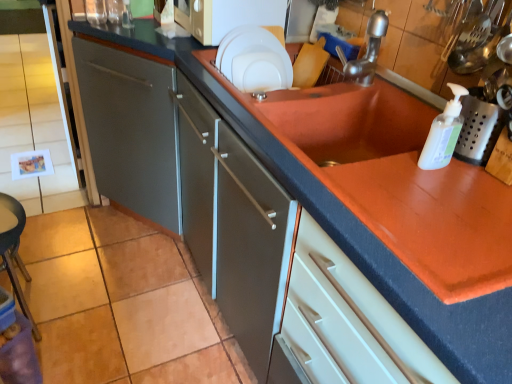
Question: Could you tell me if white matte microwave at upper center is turned towards white glossy plate at upper center?

Choices:
 (A) no
 (B) yes

Answer: (A)

Question: Is white matte microwave at upper center touching white glossy plate at upper center?

Choices:
 (A) no
 (B) yes

Answer: (A)

Question: Does white matte microwave at upper center have a larger size compared to white glossy plate at upper center?

Choices:
 (A) no
 (B) yes

Answer: (B)

Question: Considering the relative sizes of white matte microwave at upper center and white glossy plate at upper center in the image provided, is white matte microwave at upper center smaller than white glossy plate at upper center?

Choices:
 (A) yes
 (B) no

Answer: (B)

Question: From the image's perspective, is white matte microwave at upper center under white glossy plate at upper center?

Choices:
 (A) yes
 (B) no

Answer: (B)

Question: Choose the correct answer: Is white matte microwave at upper center inside silver metallic faucet at upper right or outside it?

Choices:
 (A) outside
 (B) inside

Answer: (A)

Question: Considering the positions of point (208, 41) and point (349, 71), is point (208, 41) closer or farther from the camera than point (349, 71)?

Choices:
 (A) closer
 (B) farther

Answer: (B)

Question: Is white matte microwave at upper center bigger or smaller than silver metallic faucet at upper right?

Choices:
 (A) small
 (B) big

Answer: (B)

Question: Considering the positions of white matte microwave at upper center and silver metallic faucet at upper right in the image, is white matte microwave at upper center taller or shorter than silver metallic faucet at upper right?

Choices:
 (A) tall
 (B) short

Answer: (A)

Question: From their relative heights in the image, would you say white plastic soap dispenser at upper right is taller or shorter than white glossy plate at upper center?

Choices:
 (A) short
 (B) tall

Answer: (A)

Question: From the image's perspective, is white plastic soap dispenser at upper right located above or below white glossy plate at upper center?

Choices:
 (A) above
 (B) below

Answer: (B)

Question: Looking at the image, does white plastic soap dispenser at upper right seem bigger or smaller compared to white glossy plate at upper center?

Choices:
 (A) big
 (B) small

Answer: (B)

Question: Is white plastic soap dispenser at upper right to the left or to the right of white glossy plate at upper center in the image?

Choices:
 (A) left
 (B) right

Answer: (B)

Question: Considering their positions, is white plastic soap dispenser at upper right located in front of or behind white matte microwave at upper center?

Choices:
 (A) front
 (B) behind

Answer: (A)

Question: From a real-world perspective, is white plastic soap dispenser at upper right physically located above or below white matte microwave at upper center?

Choices:
 (A) above
 (B) below

Answer: (A)